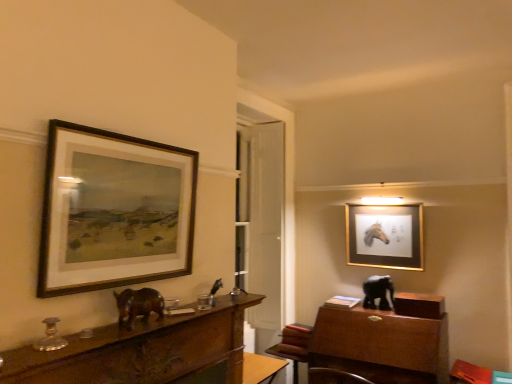
This screenshot has height=384, width=512. Describe the element at coordinates (141, 350) in the screenshot. I see `brown wooden desk at left` at that location.

Locate an element on the screen. The height and width of the screenshot is (384, 512). black glossy elephant at right, placed as the first animal when sorted from right to left is located at coordinates (378, 292).

Identify the location of brown wooden desk at left. The width and height of the screenshot is (512, 384). (141, 350).

Is wooden table at center aimed at shiny brown elephant at center, which appears as the second animal when ordered from the bottom?

No, wooden table at center does not turn towards shiny brown elephant at center, which appears as the second animal when ordered from the bottom.

Measure the distance from wooden table at center to shiny brown elephant at center, which appears as the 1th animal when viewed from the front.

1.84 meters.

Which object is thinner, wooden table at center or shiny brown elephant at center, the first animal from the top?

shiny brown elephant at center, the first animal from the top.

Which of these two, wooden table at center or shiny brown elephant at center, which is the second animal from right to left, stands taller?

With more height is wooden table at center.

Between black glossy elephant at right, placed as the first animal when sorted from right to left, and brown wooden desk at left, which one has smaller width?

black glossy elephant at right, placed as the first animal when sorted from right to left, is thinner.

From a real-world perspective, which is physically above, black glossy elephant at right, placed as the first animal when sorted from right to left, or brown wooden desk at left?

brown wooden desk at left is physically above.

Based on the photo, considering the positions of objects black glossy elephant at right, placed as the first animal when sorted from right to left, and brown wooden desk at left in the image provided, who is in front, black glossy elephant at right, placed as the first animal when sorted from right to left, or brown wooden desk at left?

brown wooden desk at left is more forward.

Can you confirm if brown wooden desk at left is thinner than wooden table at center?

Yes.

Identify the location of desk above the wooden table at center (from the image's perspective). (141, 350).

Is wooden table at center at the back of brown wooden desk at left?

That's not correct — brown wooden desk at left is not looking away from wooden table at center.

Considering the relative sizes of brown wooden desk at left and wooden table at center in the image provided, is brown wooden desk at left bigger than wooden table at center?

No, brown wooden desk at left is not bigger than wooden table at center.

Which object is wider, shiny brown elephant at center, the first animal from the top, or wooden-framed painting at upper left, which appears as the first picture frame when viewed from the left?

Wider between the two is shiny brown elephant at center, the first animal from the top.

Is point (141, 305) in front of point (190, 205)?

Yes, it is in front of point (190, 205).

From the image's perspective, is shiny brown elephant at center, which is the second animal from right to left, positioned above or below wooden-framed painting at upper left, the 1th picture frame positioned from the front?

shiny brown elephant at center, which is the second animal from right to left, is situated lower than wooden-framed painting at upper left, the 1th picture frame positioned from the front, in the image.

Based on the photo, in terms of size, does shiny brown elephant at center, acting as the 2th animal starting from the back, appear bigger or smaller than wooden-framed painting at upper left, the 2th picture frame positioned from the back?

In the image, shiny brown elephant at center, acting as the 2th animal starting from the back, appears to be smaller than wooden-framed painting at upper left, the 2th picture frame positioned from the back.

This screenshot has width=512, height=384. Identify the location of desk in front of the gold metallic picture frame at upper right, marked as the second picture frame in a left-to-right arrangement. (141, 350).

Is brown wooden desk at left at the back of gold metallic picture frame at upper right, acting as the 1th picture frame starting from the right?

No, gold metallic picture frame at upper right, acting as the 1th picture frame starting from the right, is not facing away from brown wooden desk at left.

Is gold metallic picture frame at upper right, acting as the 1th picture frame starting from the right, to the right of brown wooden desk at left from the viewer's perspective?

Indeed, gold metallic picture frame at upper right, acting as the 1th picture frame starting from the right, is positioned on the right side of brown wooden desk at left.

Considering the relative sizes of gold metallic picture frame at upper right, which appears as the 1th picture frame when viewed from the back, and brown wooden desk at left in the image provided, is gold metallic picture frame at upper right, which appears as the 1th picture frame when viewed from the back, wider than brown wooden desk at left?

Incorrect, the width of gold metallic picture frame at upper right, which appears as the 1th picture frame when viewed from the back, does not surpass that of brown wooden desk at left.

Who is more distant, shiny brown elephant at center, which appears as the 1th animal when viewed from the front, or black glossy elephant at right, placed as the first animal when sorted from right to left?

black glossy elephant at right, placed as the first animal when sorted from right to left, is more distant.

From a real-world perspective, which object stands above the other?

From a 3D spatial view, shiny brown elephant at center, which is the second animal from right to left, is above.

Could you measure the distance between shiny brown elephant at center, which appears as the 1th animal when viewed from the front, and black glossy elephant at right, placed as the first animal when sorted from bottom to top?

shiny brown elephant at center, which appears as the 1th animal when viewed from the front, and black glossy elephant at right, placed as the first animal when sorted from bottom to top, are 6.59 feet apart from each other.

Who is smaller, shiny brown elephant at center, which is counted as the first animal, starting from the left, or black glossy elephant at right, the 2th animal positioned from the left?

shiny brown elephant at center, which is counted as the first animal, starting from the left, is smaller.

Is gold metallic picture frame at upper right, which appears as the second picture frame when viewed from the front, beside wooden-framed painting at upper left, the 1th picture frame positioned from the front?

No, gold metallic picture frame at upper right, which appears as the second picture frame when viewed from the front, is not touching wooden-framed painting at upper left, the 1th picture frame positioned from the front.

Consider the image. Can wooden-framed painting at upper left, which appears as the first picture frame when viewed from the left, be found inside gold metallic picture frame at upper right, which appears as the second picture frame when viewed from the front?

No, wooden-framed painting at upper left, which appears as the first picture frame when viewed from the left, is located outside of gold metallic picture frame at upper right, which appears as the second picture frame when viewed from the front.

What's the angular difference between gold metallic picture frame at upper right, acting as the 1th picture frame starting from the right, and wooden-framed painting at upper left, the 1th picture frame positioned from the front,'s facing directions?

The facing directions of gold metallic picture frame at upper right, acting as the 1th picture frame starting from the right, and wooden-framed painting at upper left, the 1th picture frame positioned from the front, are 91.1 degrees apart.

This screenshot has height=384, width=512. Find the location of `table that appears on the right of shiny brown elephant at center, acting as the 2th animal starting from the back`. table that appears on the right of shiny brown elephant at center, acting as the 2th animal starting from the back is located at coordinates (291, 355).

This screenshot has width=512, height=384. In order to click on the 2nd animal behind the brown wooden desk at left in this screenshot , I will do `click(378, 292)`.

Estimate the real-world distances between objects in this image. Which object is further from wooden-framed painting at upper left, the 2th picture frame positioned from the back, brown wooden desk at left or black glossy elephant at right, which is the 1th animal in back-to-front order?

black glossy elephant at right, which is the 1th animal in back-to-front order.

Looking at the image, which one is located closer to gold metallic picture frame at upper right, which appears as the 1th picture frame when viewed from the back, wooden table at center or wooden-framed painting at upper left, the 1th picture frame positioned from the front?

Based on the image, wooden table at center appears to be nearer to gold metallic picture frame at upper right, which appears as the 1th picture frame when viewed from the back.

Estimate the real-world distances between objects in this image. Which object is closer to black glossy elephant at right, which is the 1th animal in back-to-front order, wooden table at center or shiny brown elephant at center, which is counted as the first animal, starting from the left?

Among the two, wooden table at center is located nearer to black glossy elephant at right, which is the 1th animal in back-to-front order.

When comparing their distances from wooden-framed painting at upper left, the 2th picture frame positioned from the back, does shiny brown elephant at center, which is the second animal from right to left, or wooden table at center seem closer?

shiny brown elephant at center, which is the second animal from right to left.

Considering their positions, is black glossy elephant at right, the 2th animal positioned from the left, positioned further to shiny brown elephant at center, which is the second animal from right to left, than gold metallic picture frame at upper right, acting as the 1th picture frame starting from the right?

Among the two, gold metallic picture frame at upper right, acting as the 1th picture frame starting from the right, is located further to shiny brown elephant at center, which is the second animal from right to left.

Estimate the real-world distances between objects in this image. Which object is further from gold metallic picture frame at upper right, acting as the 1th picture frame starting from the right, black glossy elephant at right, which is the 1th animal in back-to-front order, or brown wooden desk at left?

brown wooden desk at left is further to gold metallic picture frame at upper right, acting as the 1th picture frame starting from the right.

Estimate the real-world distances between objects in this image. Which object is further from black glossy elephant at right, the 2th animal positioned from the left, gold metallic picture frame at upper right, which appears as the second picture frame when viewed from the front, or wooden-framed painting at upper left, the 2th picture frame positioned from the back?

The object further to black glossy elephant at right, the 2th animal positioned from the left, is wooden-framed painting at upper left, the 2th picture frame positioned from the back.

Based on their spatial positions, is black glossy elephant at right, placed as the first animal when sorted from bottom to top, or wooden-framed painting at upper left, the 2th picture frame positioned from the back, further from gold metallic picture frame at upper right, which appears as the 1th picture frame when viewed from the back?

wooden-framed painting at upper left, the 2th picture frame positioned from the back, lies further to gold metallic picture frame at upper right, which appears as the 1th picture frame when viewed from the back, than the other object.

You are a GUI agent. You are given a task and a screenshot of the screen. Output one action in this format:
    pyautogui.click(x=<x>, y=<y>)
    Task: Click on the animal positioned between shiny brown elephant at center, which appears as the second animal when ordered from the bottom, and gold metallic picture frame at upper right, which appears as the second picture frame when viewed from the front, from near to far
    
    Given the screenshot: What is the action you would take?
    point(378,292)

At what (x,y) coordinates should I click in order to perform the action: click on animal located between wooden-framed painting at upper left, which appears as the first picture frame when viewed from the left, and black glossy elephant at right, placed as the first animal when sorted from bottom to top, in the depth direction. Please return your answer as a coordinate pair (x, y). This screenshot has height=384, width=512. Looking at the image, I should click on (138, 305).

I want to click on picture frame positioned between brown wooden desk at left and wooden table at center from near to far, so click(x=113, y=211).

The width and height of the screenshot is (512, 384). Identify the location of table between shiny brown elephant at center, which appears as the second animal when ordered from the bottom, and gold metallic picture frame at upper right, acting as the 1th picture frame starting from the right, along the z-axis. (291, 355).